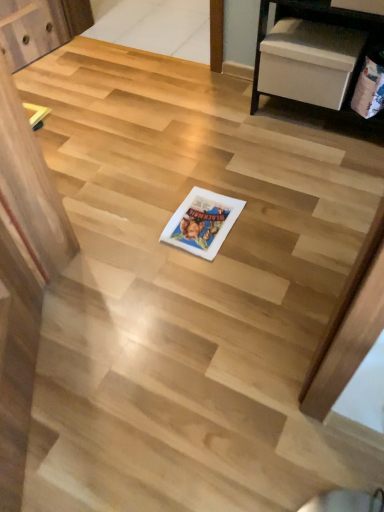
Locate an element on the screen. This screenshot has height=512, width=384. matte paper comic book at right, positioned as the second comic book in left-to-right order is located at coordinates (370, 86).

Describe the element at coordinates (370, 86) in the screenshot. This screenshot has height=512, width=384. I see `matte paper comic book at right, positioned as the second comic book in left-to-right order` at that location.

Where is `white paper comic book at center, which ranks as the first comic book in bottom-to-top order`? white paper comic book at center, which ranks as the first comic book in bottom-to-top order is located at coordinates (202, 222).

What do you see at coordinates (202, 222) in the screenshot?
I see `white paper comic book at center, the 2th comic book in the right-to-left sequence` at bounding box center [202, 222].

Identify the location of matte paper comic book at right, positioned as the second comic book in left-to-right order. This screenshot has height=512, width=384. (370, 86).

Which object is positioned more to the left, white paper comic book at center, the 2th comic book in the right-to-left sequence, or matte paper comic book at right, the 1th comic book in the right-to-left sequence?

From the viewer's perspective, white paper comic book at center, the 2th comic book in the right-to-left sequence, appears more on the left side.

Which object is more forward, white paper comic book at center, the 2th comic book when ordered from top to bottom, or matte paper comic book at right, positioned as the second comic book in left-to-right order?

white paper comic book at center, the 2th comic book when ordered from top to bottom.

Does point (213, 232) come closer to viewer compared to point (369, 105)?

Yes, point (213, 232) is closer to viewer.

From the image's perspective, is white paper comic book at center, which ranks as the first comic book in bottom-to-top order, located above or below matte paper comic book at right, the 1th comic book in the right-to-left sequence?

Based on their image positions, white paper comic book at center, which ranks as the first comic book in bottom-to-top order, is located beneath matte paper comic book at right, the 1th comic book in the right-to-left sequence.

From a real-world perspective, is white paper comic book at center, which ranks as the first comic book in bottom-to-top order, physically located above or below matte paper comic book at right, which is the 1th comic book from top to bottom?

From a real-world perspective, white paper comic book at center, which ranks as the first comic book in bottom-to-top order, is physically below matte paper comic book at right, which is the 1th comic book from top to bottom.

Can you confirm if white paper comic book at center, which is counted as the 1th comic book, starting from the left, is wider than matte paper comic book at right, which is the 1th comic book from top to bottom?

Correct, the width of white paper comic book at center, which is counted as the 1th comic book, starting from the left, exceeds that of matte paper comic book at right, which is the 1th comic book from top to bottom.

Considering the relative sizes of white paper comic book at center, which is counted as the 1th comic book, starting from the left, and matte paper comic book at right, positioned as the second comic book in left-to-right order, in the image provided, is white paper comic book at center, which is counted as the 1th comic book, starting from the left, shorter than matte paper comic book at right, positioned as the second comic book in left-to-right order,?

Yes, white paper comic book at center, which is counted as the 1th comic book, starting from the left, is shorter than matte paper comic book at right, positioned as the second comic book in left-to-right order.

Considering the sizes of white paper comic book at center, the 2th comic book in the right-to-left sequence, and matte paper comic book at right, which is the 1th comic book from top to bottom, in the image, is white paper comic book at center, the 2th comic book in the right-to-left sequence, bigger or smaller than matte paper comic book at right, which is the 1th comic book from top to bottom,?

Considering their sizes, white paper comic book at center, the 2th comic book in the right-to-left sequence, takes up less space than matte paper comic book at right, which is the 1th comic book from top to bottom.

Which is correct: white paper comic book at center, the 2th comic book in the right-to-left sequence, is inside matte paper comic book at right, positioned as the second comic book in left-to-right order, or outside of it?

white paper comic book at center, the 2th comic book in the right-to-left sequence, is spatially situated outside matte paper comic book at right, positioned as the second comic book in left-to-right order.

Are white paper comic book at center, which ranks as the first comic book in bottom-to-top order, and matte paper comic book at right, which is the 1th comic book from top to bottom, making contact?

white paper comic book at center, which ranks as the first comic book in bottom-to-top order, and matte paper comic book at right, which is the 1th comic book from top to bottom, are clearly separated.

Is white paper comic book at center, the 2th comic book when ordered from top to bottom, facing away from matte paper comic book at right, the 2th comic book when ordered from bottom to top?

No, matte paper comic book at right, the 2th comic book when ordered from bottom to top, is not at the back of white paper comic book at center, the 2th comic book when ordered from top to bottom.

What's the angular difference between white paper comic book at center, the 2th comic book when ordered from top to bottom, and matte paper comic book at right, which is the 1th comic book from top to bottom,'s facing directions?

The angle between the facing direction of white paper comic book at center, the 2th comic book when ordered from top to bottom, and the facing direction of matte paper comic book at right, which is the 1th comic book from top to bottom, is 0.848 degrees.

This screenshot has width=384, height=512. In order to click on comic book behind the white paper comic book at center, the 2th comic book when ordered from top to bottom in this screenshot , I will do `click(370, 86)`.

Is matte paper comic book at right, the 2th comic book when ordered from bottom to top, to the left of white paper comic book at center, which is counted as the 1th comic book, starting from the left, from the viewer's perspective?

No, matte paper comic book at right, the 2th comic book when ordered from bottom to top, is not to the left of white paper comic book at center, which is counted as the 1th comic book, starting from the left.

Which object is more forward, matte paper comic book at right, the 2th comic book when ordered from bottom to top, or white paper comic book at center, which is counted as the 1th comic book, starting from the left?

white paper comic book at center, which is counted as the 1th comic book, starting from the left, is closer to the camera.

Considering the positions of point (373, 106) and point (171, 217), is point (373, 106) closer or farther from the camera than point (171, 217)?

Point (373, 106) appears to be farther away from the viewer than point (171, 217).

From the image's perspective, is matte paper comic book at right, the 2th comic book when ordered from bottom to top, positioned above or below white paper comic book at center, the 2th comic book when ordered from top to bottom?

From the image's perspective, matte paper comic book at right, the 2th comic book when ordered from bottom to top, appears above white paper comic book at center, the 2th comic book when ordered from top to bottom.

From a real-world perspective, is matte paper comic book at right, the 1th comic book in the right-to-left sequence, physically below white paper comic book at center, which ranks as the first comic book in bottom-to-top order?

No, from a real-world perspective, matte paper comic book at right, the 1th comic book in the right-to-left sequence, is not below white paper comic book at center, which ranks as the first comic book in bottom-to-top order.

Which of these two, matte paper comic book at right, the 1th comic book in the right-to-left sequence, or white paper comic book at center, the 2th comic book when ordered from top to bottom, is thinner?

matte paper comic book at right, the 1th comic book in the right-to-left sequence.

Consider the image. Is matte paper comic book at right, the 2th comic book when ordered from bottom to top, shorter than white paper comic book at center, which ranks as the first comic book in bottom-to-top order?

No, matte paper comic book at right, the 2th comic book when ordered from bottom to top, is not shorter than white paper comic book at center, which ranks as the first comic book in bottom-to-top order.

Considering the relative sizes of matte paper comic book at right, the 2th comic book when ordered from bottom to top, and white paper comic book at center, which ranks as the first comic book in bottom-to-top order, in the image provided, is matte paper comic book at right, the 2th comic book when ordered from bottom to top, bigger than white paper comic book at center, which ranks as the first comic book in bottom-to-top order,?

Indeed, matte paper comic book at right, the 2th comic book when ordered from bottom to top, has a larger size compared to white paper comic book at center, which ranks as the first comic book in bottom-to-top order.

Is white paper comic book at center, which ranks as the first comic book in bottom-to-top order, completely or partially inside matte paper comic book at right, the 1th comic book in the right-to-left sequence?

No, white paper comic book at center, which ranks as the first comic book in bottom-to-top order, is located outside of matte paper comic book at right, the 1th comic book in the right-to-left sequence.

Is matte paper comic book at right, which is the 1th comic book from top to bottom, placed right next to white paper comic book at center, the 2th comic book when ordered from top to bottom?

There is a gap between matte paper comic book at right, which is the 1th comic book from top to bottom, and white paper comic book at center, the 2th comic book when ordered from top to bottom.

Is matte paper comic book at right, the 1th comic book in the right-to-left sequence, aimed at white paper comic book at center, which is counted as the 1th comic book, starting from the left?

No, matte paper comic book at right, the 1th comic book in the right-to-left sequence, is not facing towards white paper comic book at center, which is counted as the 1th comic book, starting from the left.

This screenshot has height=512, width=384. What are the coordinates of `comic book positioned vertically above the white paper comic book at center, which ranks as the first comic book in bottom-to-top order (from a real-world perspective)` in the screenshot? It's located at (370, 86).

Identify the location of comic book directly beneath the matte paper comic book at right, positioned as the second comic book in left-to-right order (from a real-world perspective). (202, 222).

Where is `comic book lying on the right of white paper comic book at center, which is counted as the 1th comic book, starting from the left`? comic book lying on the right of white paper comic book at center, which is counted as the 1th comic book, starting from the left is located at coordinates (370, 86).